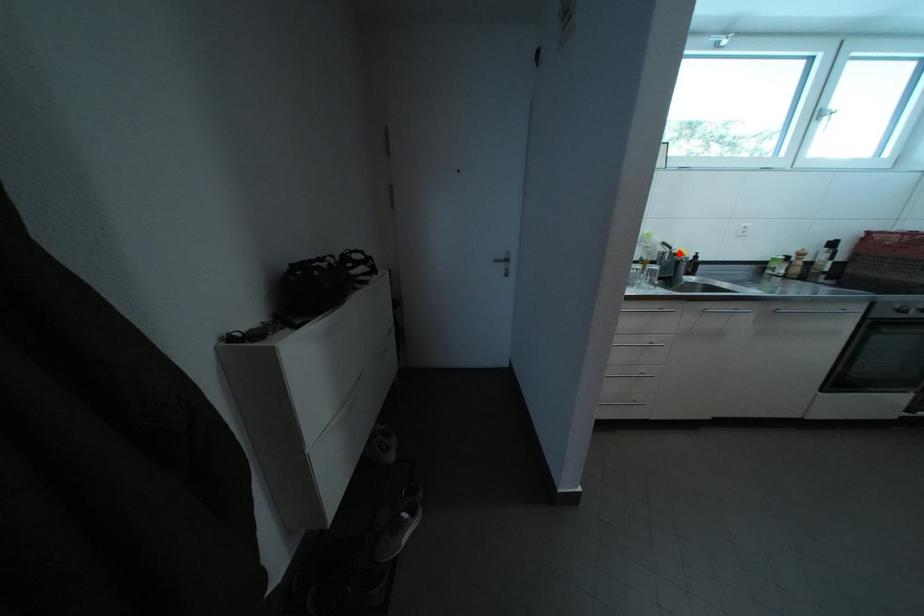
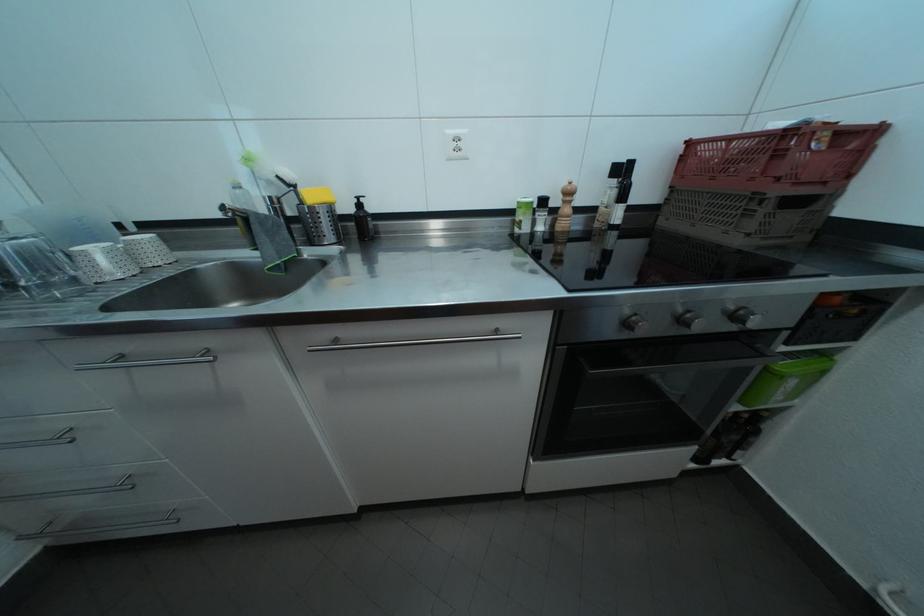
Where in the second image is the point corresponding to the highlighted location from the first image?

(304, 192)